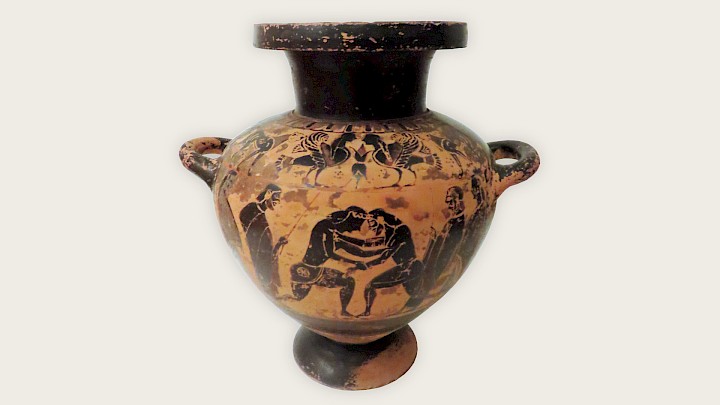
Find the location of a particular element. The width and height of the screenshot is (720, 405). vase base is located at coordinates (354, 349).